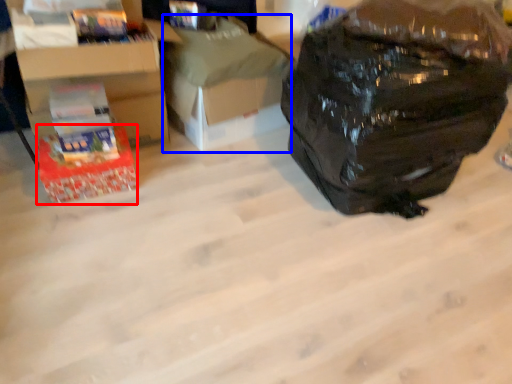
Question: Among these objects, which one is farthest to the camera, box (highlighted by a red box) or cardboard box (highlighted by a blue box)?

Choices:
 (A) box
 (B) cardboard box

Answer: (B)